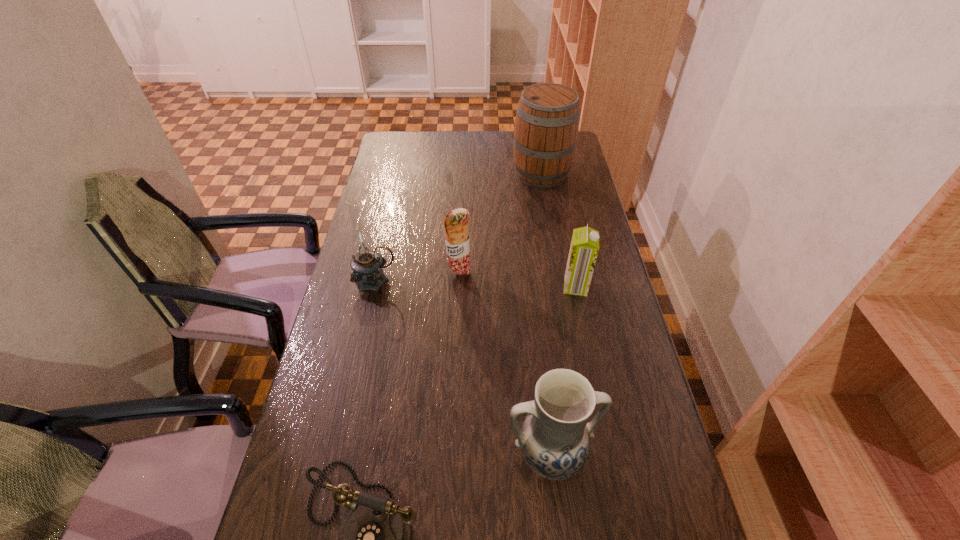
Identify the location of object that is at the far edge. (546, 128).

At what (x,y) coordinates should I click in order to perform the action: click on object located in the left edge section of the desktop. Please return your answer as a coordinate pair (x, y). The width and height of the screenshot is (960, 540). Looking at the image, I should click on (367, 265).

The width and height of the screenshot is (960, 540). I want to click on cider present at the right edge, so click(546, 128).

The image size is (960, 540). Identify the location of soya milk present at the right edge. (584, 247).

This screenshot has height=540, width=960. Find the location of `object located in the far right corner section of the desktop`. object located in the far right corner section of the desktop is located at coordinates (546, 128).

I want to click on vacant space at the far edge, so click(x=509, y=153).

This screenshot has height=540, width=960. Find the location of `free region at the left edge`. free region at the left edge is located at coordinates (325, 386).

The image size is (960, 540). In order to click on vacant space at the right edge in this screenshot , I will do `click(610, 525)`.

Find the location of a particular element. The image size is (960, 540). vacant region at the far left corner of the desktop is located at coordinates (396, 148).

Find the location of `vacant point located between the pottery and the farthest object`. vacant point located between the pottery and the farthest object is located at coordinates (545, 314).